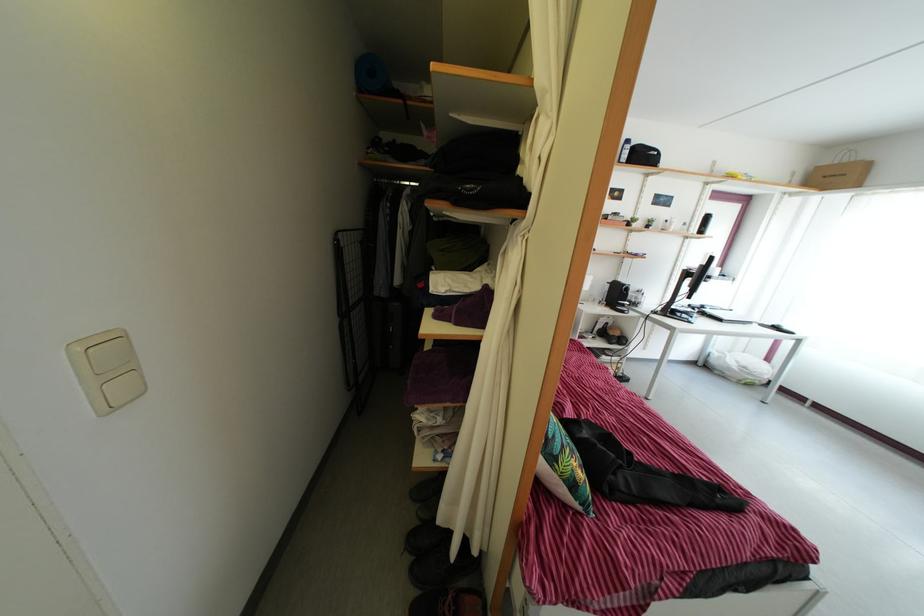
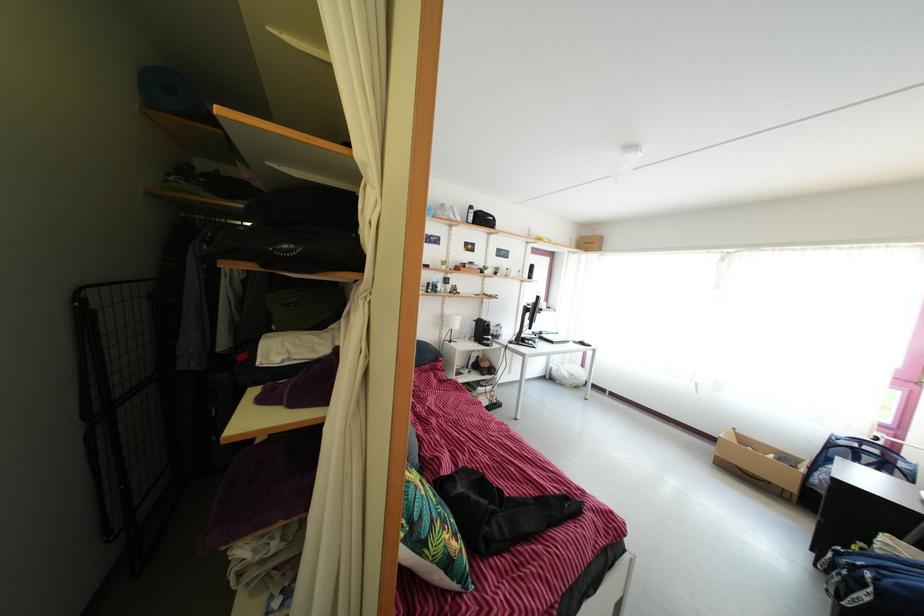
In the second image, find the point that corresponds to point 343,246 in the first image.

(86, 307)